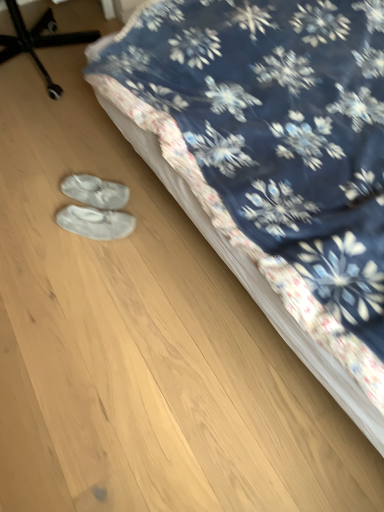
In order to click on free space in front of white fabric shoe covers at lower left, arranged as the second footwear when ordered from the bottom in this screenshot , I will do `click(89, 246)`.